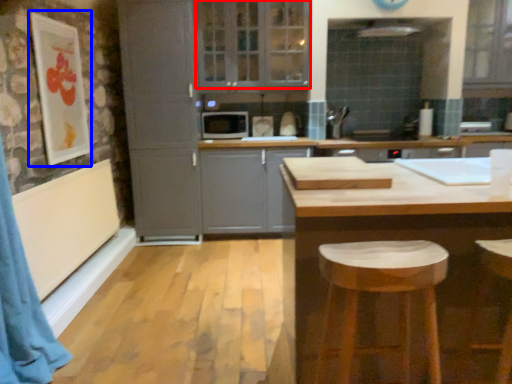
Question: Which object is closer to the camera taking this photo, window (highlighted by a red box) or picture frame (highlighted by a blue box)?

Choices:
 (A) window
 (B) picture frame

Answer: (B)